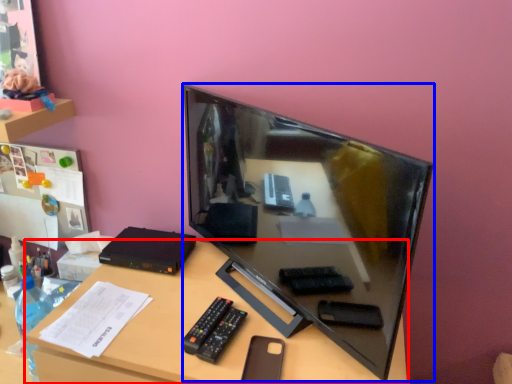
Question: Which of the following is the farthest to the observer, desk (highlighted by a red box) or television (highlighted by a blue box)?

Choices:
 (A) desk
 (B) television

Answer: (A)